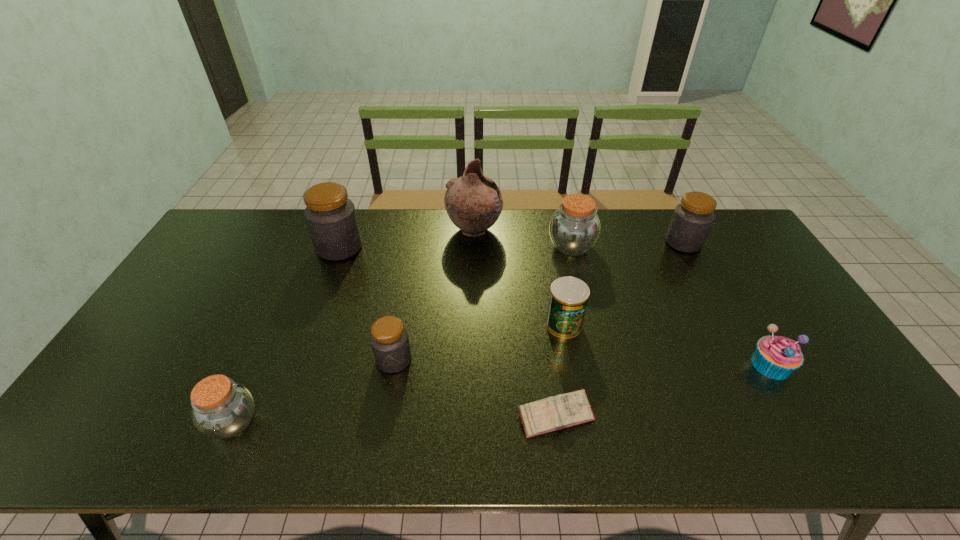
The height and width of the screenshot is (540, 960). Find the location of `unoccupied area between the second smallest gray jar and the smallest gray jar`. unoccupied area between the second smallest gray jar and the smallest gray jar is located at coordinates (539, 301).

At what (x,y) coordinates should I click in order to perform the action: click on free space between the rightmost gray jar and the blue muffin. Please return your answer as a coordinate pair (x, y). The height and width of the screenshot is (540, 960). Looking at the image, I should click on (727, 303).

Identify the location of vacant area between the bigger brown jar and the muffin. This screenshot has height=540, width=960. (671, 306).

Where is `blank region between the rightmost jar and the leftmost gray jar`? The width and height of the screenshot is (960, 540). blank region between the rightmost jar and the leftmost gray jar is located at coordinates (512, 245).

At what (x,y) coordinates should I click in order to perform the action: click on unoccupied position between the left brown jar and the rightmost jar. Please return your answer as a coordinate pair (x, y). This screenshot has width=960, height=540. Looking at the image, I should click on (458, 332).

Where is `vacant area that lies between the rightmost jar and the pink diary`? The height and width of the screenshot is (540, 960). vacant area that lies between the rightmost jar and the pink diary is located at coordinates (619, 329).

Locate an element on the screen. The image size is (960, 540). the sixth closest object relative to the tallest jar is located at coordinates (569, 409).

The height and width of the screenshot is (540, 960). What are the coordinates of `object that is the eighth nearest to the nearest jar` in the screenshot? It's located at (692, 219).

Identify which jar is the third closest to the muffin. Please provide its 2D coordinates. Your answer should be formatted as a tuple, i.e. [(x, y)], where the tuple contains the x and y coordinates of a point satisfying the conditions above.

[(389, 339)]

The height and width of the screenshot is (540, 960). Find the location of `the third closest jar relative to the nearest jar`. the third closest jar relative to the nearest jar is located at coordinates (574, 228).